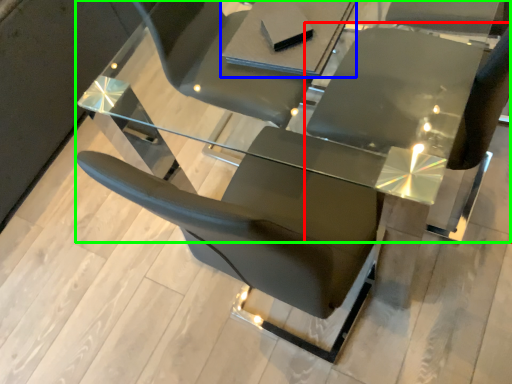
Question: Which object is positioned closest to chair (highlighted by a red box)? Select from table (highlighted by a blue box) and table (highlighted by a green box).

Choices:
 (A) table
 (B) table

Answer: (B)